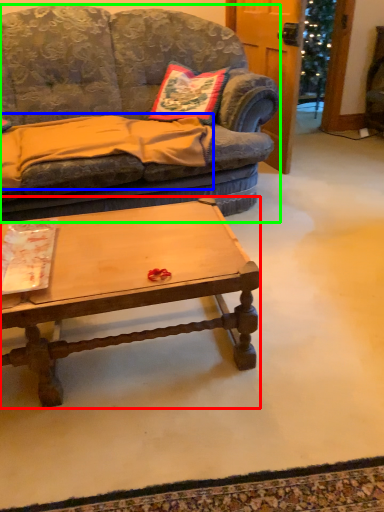
Question: Considering the real-world distances, which object is closest to coffee table (highlighted by a red box)? blanket (highlighted by a blue box) or studio couch (highlighted by a green box).

Choices:
 (A) blanket
 (B) studio couch

Answer: (A)